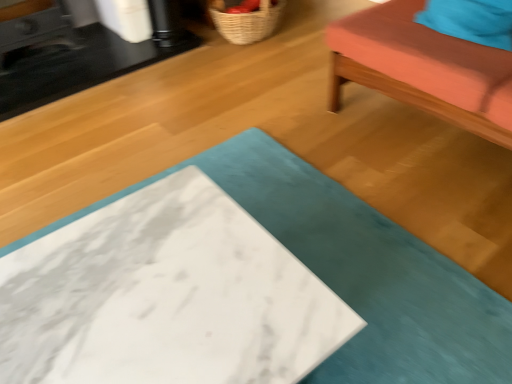
Question: Does teal fabric cushion at upper right lie in front of black marble table at upper left, which is the 1th table from back to front?

Choices:
 (A) no
 (B) yes

Answer: (B)

Question: Does teal fabric cushion at upper right have a smaller size compared to black marble table at upper left, which ranks as the second table in bottom-to-top order?

Choices:
 (A) yes
 (B) no

Answer: (B)

Question: From a real-world perspective, is teal fabric cushion at upper right positioned over black marble table at upper left, which is the 1th table from back to front, based on gravity?

Choices:
 (A) no
 (B) yes

Answer: (B)

Question: Does teal fabric cushion at upper right have a greater width compared to black marble table at upper left, which ranks as the second table in bottom-to-top order?

Choices:
 (A) yes
 (B) no

Answer: (A)

Question: From a real-world perspective, is teal fabric cushion at upper right beneath black marble table at upper left, the 1th table positioned from the top?

Choices:
 (A) yes
 (B) no

Answer: (B)

Question: Is white marble table at center, which ranks as the 1th table in front-to-back order, spatially inside teal fabric cushion at upper right, or outside of it?

Choices:
 (A) inside
 (B) outside

Answer: (B)

Question: From a real-world perspective, relative to teal fabric cushion at upper right, is white marble table at center, arranged as the 1th table when ordered from the bottom, vertically above or below?

Choices:
 (A) below
 (B) above

Answer: (A)

Question: Is point (352, 360) closer or farther from the camera than point (348, 59)?

Choices:
 (A) closer
 (B) farther

Answer: (A)

Question: Visually, is white marble table at center, marked as the second table in a back-to-front arrangement, positioned to the left or to the right of teal fabric cushion at upper right?

Choices:
 (A) left
 (B) right

Answer: (A)

Question: Considering the positions of point (53, 39) and point (438, 3), is point (53, 39) closer or farther from the camera than point (438, 3)?

Choices:
 (A) farther
 (B) closer

Answer: (A)

Question: Is black marble table at upper left, which is the 1th table from back to front, inside or outside of teal fabric pillow at upper right?

Choices:
 (A) outside
 (B) inside

Answer: (A)

Question: Based on their sizes in the image, would you say black marble table at upper left, which ranks as the second table in bottom-to-top order, is bigger or smaller than teal fabric pillow at upper right?

Choices:
 (A) small
 (B) big

Answer: (B)

Question: Based on their positions, is black marble table at upper left, which ranks as the second table in bottom-to-top order, located to the left or right of teal fabric pillow at upper right?

Choices:
 (A) left
 (B) right

Answer: (A)

Question: In terms of width, does woven straw basket at upper center look wider or thinner when compared to teal fabric pillow at upper right?

Choices:
 (A) thin
 (B) wide

Answer: (B)

Question: From the image's perspective, is woven straw basket at upper center above or below teal fabric pillow at upper right?

Choices:
 (A) above
 (B) below

Answer: (A)